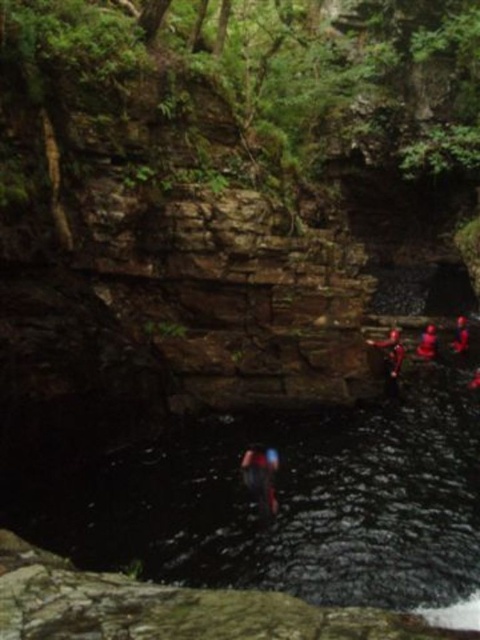
Question: Which object is closer to the camera taking this photo?

Choices:
 (A) red fabric person at right
 (B) dark blue fabric at center

Answer: (B)

Question: Does matte red helmet at right appear over red fabric person at right?

Choices:
 (A) yes
 (B) no

Answer: (B)

Question: Does dark blue fabric at center come behind red fabric person at right?

Choices:
 (A) yes
 (B) no

Answer: (B)

Question: Can you confirm if matte red helmet at right is bigger than red fabric person at right?

Choices:
 (A) no
 (B) yes

Answer: (A)

Question: Which of the following is the closest to the observer?

Choices:
 (A) dark blue fabric at center
 (B) matte red helmet at right

Answer: (A)

Question: Among these objects, which one is farthest from the camera?

Choices:
 (A) red fabric person at right
 (B) matte red helmet at right
 (C) dark blue fabric at center

Answer: (A)